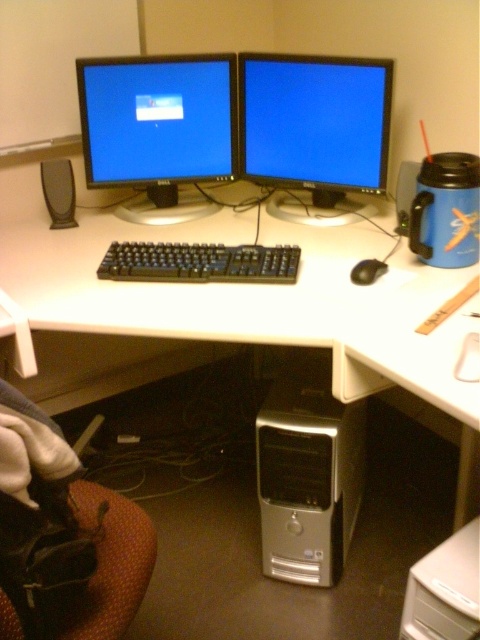
Is black plastic keyboard at center bigger than black plastic speaker at upper right?

Indeed, black plastic keyboard at center has a larger size compared to black plastic speaker at upper right.

Is point (142, 260) farther from camera compared to point (399, 179)?

No, (142, 260) is closer to viewer.

At what (x,y) coordinates should I click in order to perform the action: click on black plastic keyboard at center. Please return your answer as a coordinate pair (x, y). Looking at the image, I should click on (199, 262).

Who is positioned more to the right, white plastic computer desk at center or black matte speaker at left?

white plastic computer desk at center

From the picture: Between white plastic computer desk at center and black matte speaker at left, which one has less height?

black matte speaker at left

Identify the location of white plastic computer desk at center. The height and width of the screenshot is (640, 480). (260, 305).

Does point (218, 92) come in front of point (57, 196)?

Yes, it is in front of point (57, 196).

Can you confirm if matte black monitor at upper left is wider than black matte speaker at left?

Correct, the width of matte black monitor at upper left exceeds that of black matte speaker at left.

Describe the element at coordinates (157, 118) in the screenshot. I see `matte black monitor at upper left` at that location.

Where is `matte black monitor at upper left`? matte black monitor at upper left is located at coordinates (157, 118).